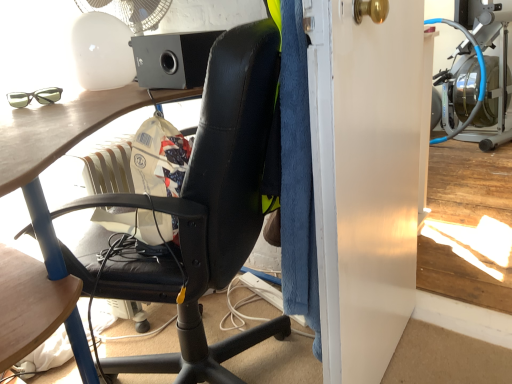
Question: Would you say white glossy screen door at right is inside or outside black matte speaker at upper center?

Choices:
 (A) inside
 (B) outside

Answer: (B)

Question: In the image, is white glossy screen door at right on the left side or the right side of black matte speaker at upper center?

Choices:
 (A) right
 (B) left

Answer: (A)

Question: Which object is positioned closest to the white glossy screen door at right?

Choices:
 (A) black leather chair at center
 (B) white plastic mechanical fan at upper left
 (C) black matte speaker at upper center
 (D) matte black glasses at upper left

Answer: (A)

Question: Considering the real-world distances, which object is farthest from the black leather chair at center?

Choices:
 (A) matte black glasses at upper left
 (B) black matte speaker at upper center
 (C) white plastic mechanical fan at upper left
 (D) white glossy screen door at right

Answer: (C)